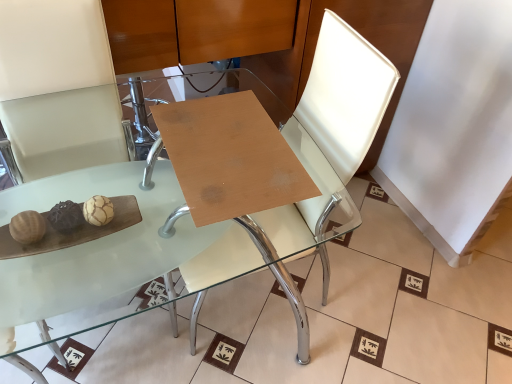
Locate an element on the screen. This screenshot has height=384, width=512. free space that is in between white leather swivel chair at center and transparent glass table at center, marked as the first table in a front-to-back arrangement is located at coordinates (324, 335).